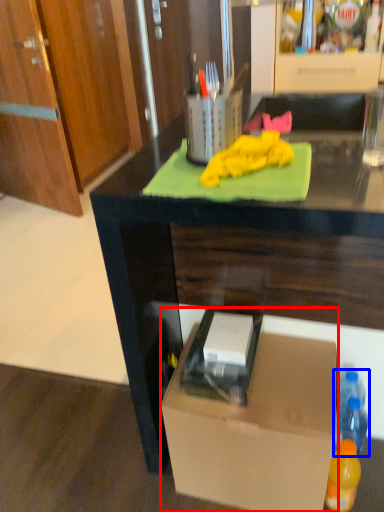
Question: Which object appears closest to the camera in this image, box (highlighted by a red box) or bottle (highlighted by a blue box)?

Choices:
 (A) box
 (B) bottle

Answer: (A)